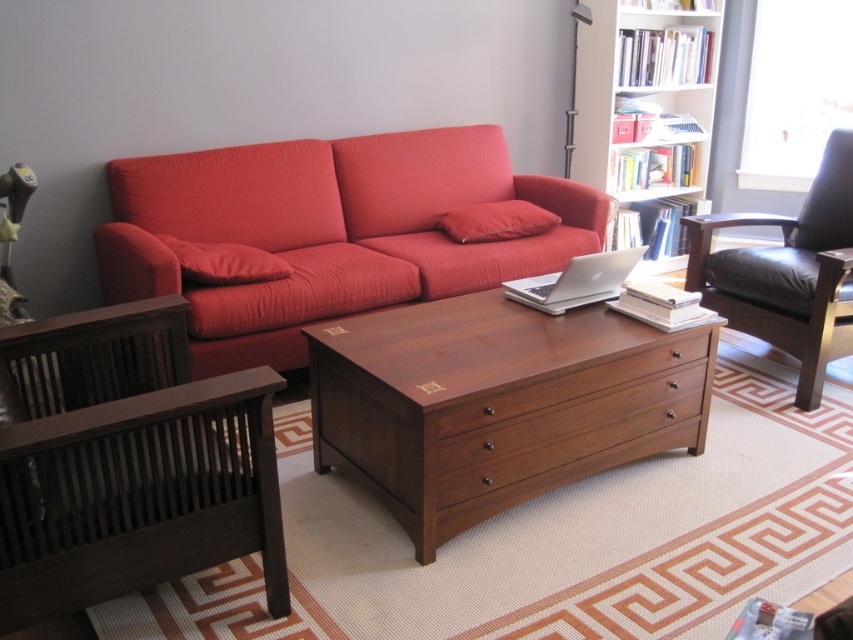
Question: Where is matte red couch at center located in relation to silver metallic laptop at center in the image?

Choices:
 (A) left
 (B) right

Answer: (A)

Question: Is silver metallic laptop at center thinner than matte red cushion at center?

Choices:
 (A) no
 (B) yes

Answer: (B)

Question: Estimate the real-world distances between objects in this image. Which object is farther from the black leather armchair at right?

Choices:
 (A) matte red pillow at center
 (B) matte red cushion at center
 (C) white wooden bookshelf at upper right

Answer: (B)

Question: Which point is closer to the camera?

Choices:
 (A) (437, 384)
 (B) (137, 195)

Answer: (A)

Question: Does matte red couch at center appear over matte red pillow at center?

Choices:
 (A) yes
 (B) no

Answer: (B)

Question: Which of the following is the farthest from the observer?

Choices:
 (A) silver metallic laptop at center
 (B) matte red couch at center

Answer: (B)